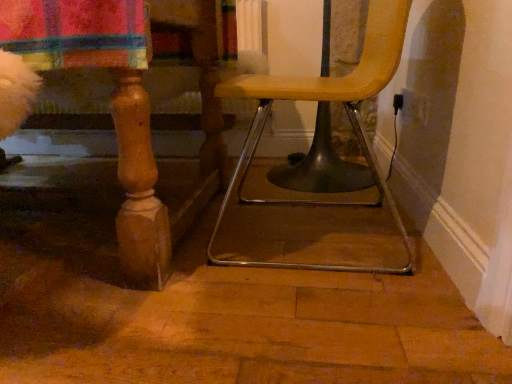
What do you see at coordinates (320, 198) in the screenshot?
I see `wooden chair at center` at bounding box center [320, 198].

I want to click on wooden chair at center, so click(320, 198).

The width and height of the screenshot is (512, 384). Find the location of `wooden chair at center`. wooden chair at center is located at coordinates coord(320,198).